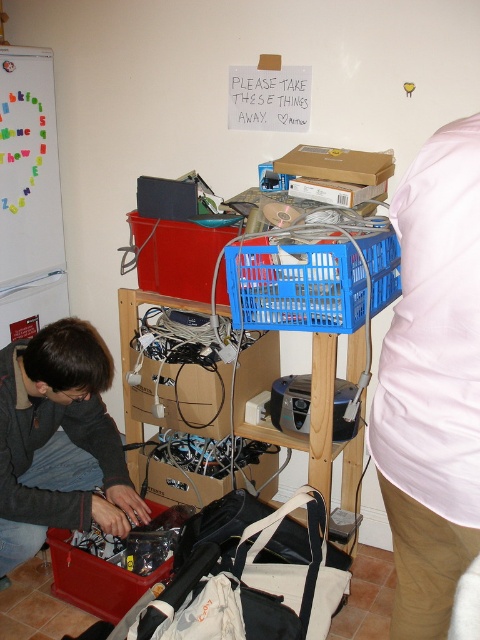
Question: Can you confirm if matte black laptop at lower left is positioned to the left of blue plastic crate at center?

Choices:
 (A) no
 (B) yes

Answer: (B)

Question: Is blue plastic crate at center to the left of matte plastic toolbox at lower left from the viewer's perspective?

Choices:
 (A) no
 (B) yes

Answer: (A)

Question: Which is nearer to the matte black laptop at lower left?

Choices:
 (A) blue plastic crate at center
 (B) matte plastic crate at center
 (C) pink fabric shirt at upper right

Answer: (B)

Question: Among these objects, which one is nearest to the camera?

Choices:
 (A) blue plastic crate at center
 (B) matte plastic toolbox at lower left

Answer: (A)

Question: Is pink fabric shirt at upper right above matte plastic crate at center?

Choices:
 (A) no
 (B) yes

Answer: (A)

Question: Among these points, which one is farthest from the camera?

Choices:
 (A) (144, 243)
 (B) (75, 605)

Answer: (A)